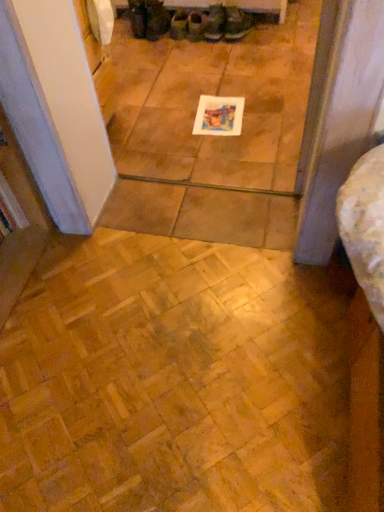
Where is `free space between white paper at center and green canvas shoes at upper center, arranged as the 4th footwear when viewed from the right`? Image resolution: width=384 pixels, height=512 pixels. free space between white paper at center and green canvas shoes at upper center, arranged as the 4th footwear when viewed from the right is located at coordinates (208, 82).